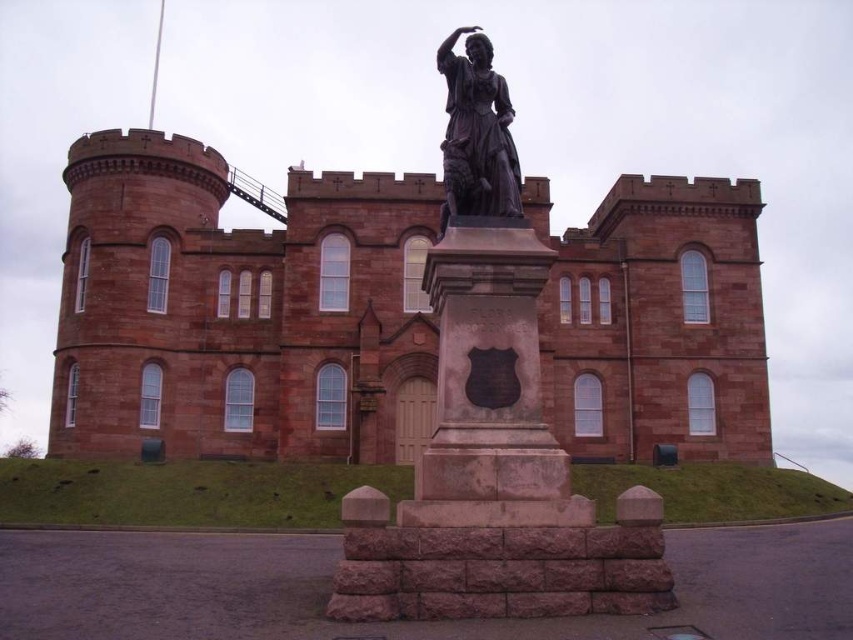
You are a visitor approaching the red stone castle at center and the bronze statue at center. Which structure is positioned higher from the ground?

The bronze statue at center is positioned higher from the ground than the red stone castle at center because the red stone castle at center is located below the bronze statue at center.

You are a tourist visiting the historic site. You want to take a photo of both the red stone castle at center and the bronze statue at center in the same frame. Given that the camera has a fixed focal length, which object should you position closer to the camera to ensure both are visible in the photo?

Since the red stone castle at center is much taller than the bronze statue at center, you should position the bronze statue at center closer to the camera. This way, the statue will appear larger in the frame, balancing its size with the taller castle in the background.

You are an architect planning to place a new decorative element between the red stone castle at center and the bronze statue at center. To ensure symmetry, you need to know which object is wider. Which one is wider?

The red stone castle at center is wider than the bronze statue at center, so the decorative element should be placed accordingly to maintain symmetry.